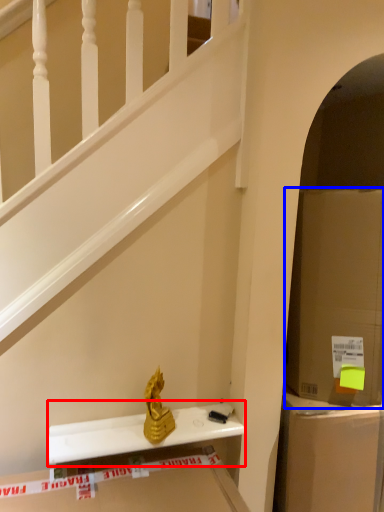
Question: Among these objects, which one is farthest to the camera, window sill (highlighted by a red box) or cardboard box (highlighted by a blue box)?

Choices:
 (A) window sill
 (B) cardboard box

Answer: (B)